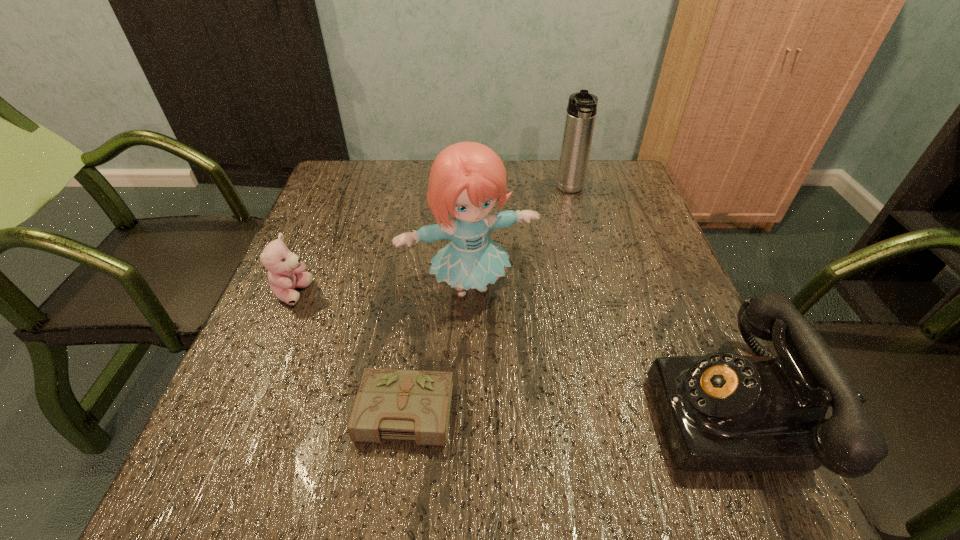
Find the location of a particular element. This screenshot has height=540, width=960. the shortest object is located at coordinates (415, 405).

Locate an element on the screen. the third tallest object is located at coordinates (723, 412).

Where is `telephone`? The height and width of the screenshot is (540, 960). telephone is located at coordinates (723, 412).

Identify the location of the tallest object. This screenshot has height=540, width=960. (466, 180).

I want to click on thermos bottle, so click(581, 111).

Identify the location of the fourth shortest object. The image size is (960, 540). (581, 111).

In order to click on the leftmost object in this screenshot , I will do `click(286, 273)`.

Identify the location of the fourth tallest object. (286, 273).

This screenshot has height=540, width=960. I want to click on vacant area situated on the left of the shortest object, so click(x=290, y=411).

The height and width of the screenshot is (540, 960). Identify the location of vacant space located 0.180m on the dial of the rightmost object. (551, 410).